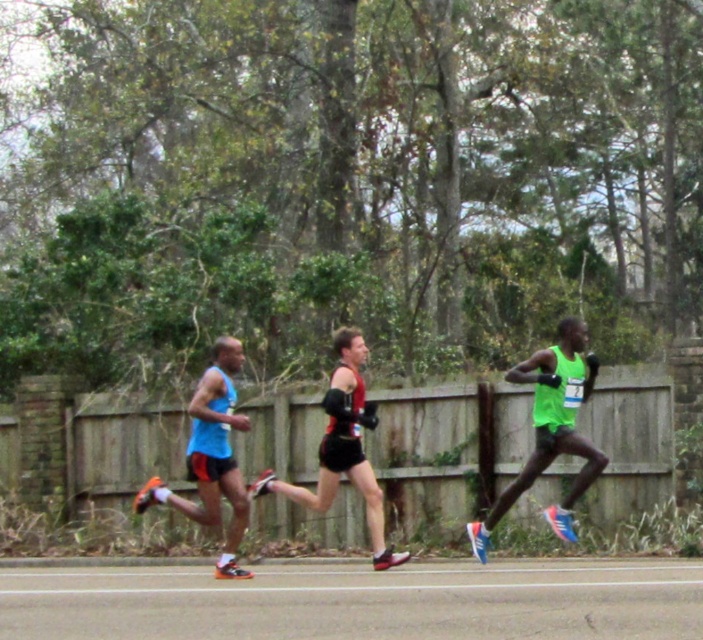
You are a photographer positioned at the camera location. You want to capture a closeup shot of the blue tank top runner. The camera can focus on objects within 30 feet. Is the point at (508, 496) within the focus range?

The point at (508, 496) is 38.50 feet away from the camera, which is beyond the 30 feet focus range. Therefore, the camera cannot focus on the blue tank top runner at that point.

You are a photographer positioned at the starting line of the marathon. You want to capture a photo of both the point at coordinates (512, 403) and the point at coordinates (567, 422) in the same frame. Based on their positions, which point is closer to your camera lens?

Point at coordinates (512, 403) is closer to the camera lens than point at coordinates (567, 422) because it is further to the viewer according to the description.